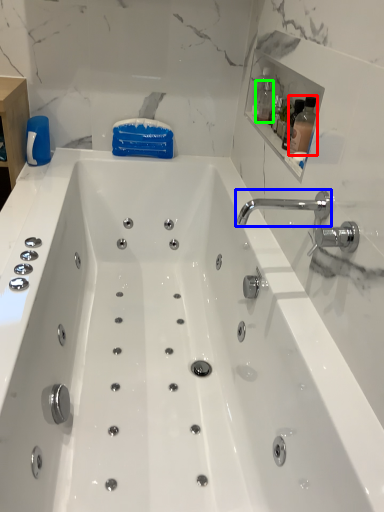
Question: Estimate the real-world distances between objects in this image. Which object is closer to bottle (highlighted by a red box), tap (highlighted by a blue box) or bottle (highlighted by a green box)?

Choices:
 (A) tap
 (B) bottle

Answer: (A)